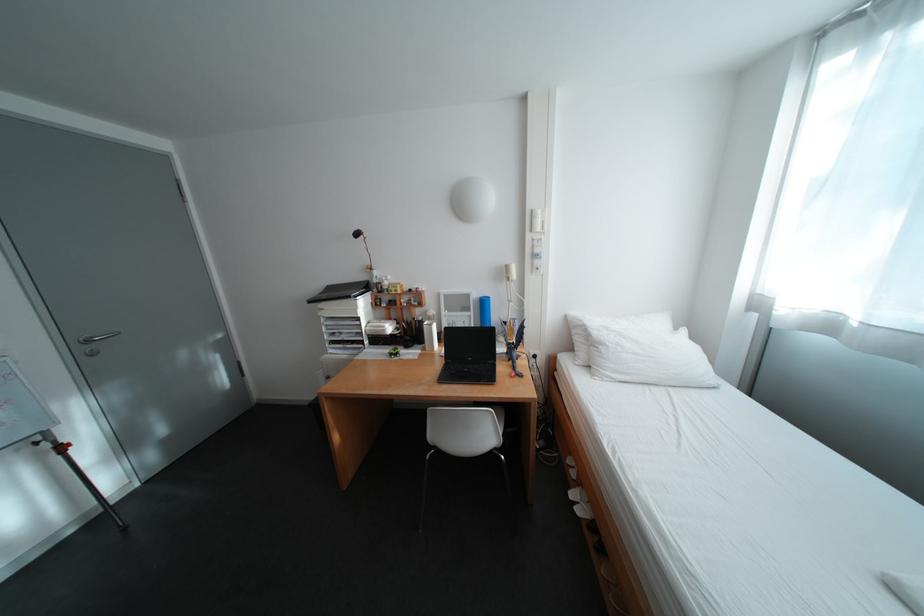
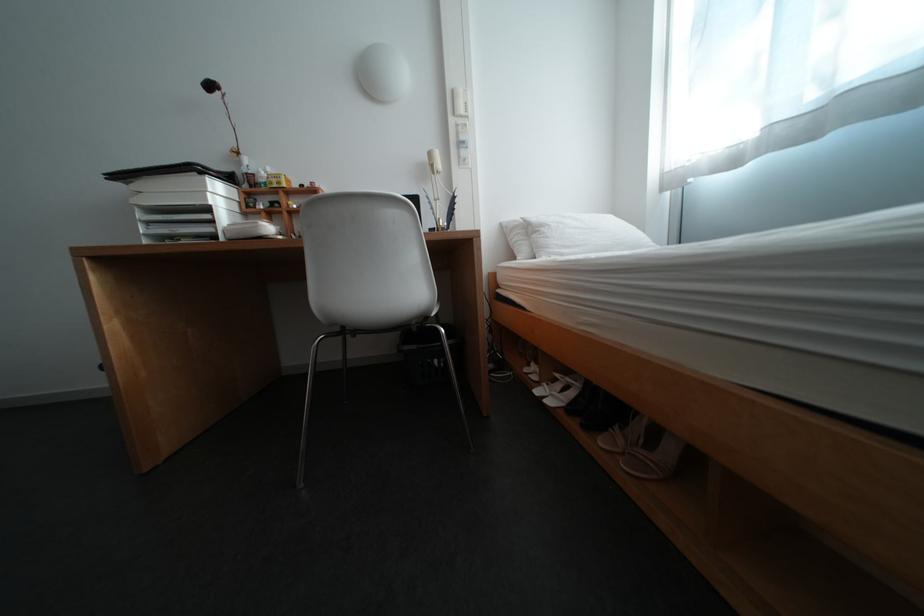
Locate, in the second image, the point that corresponds to pixel 334 322 in the first image.

(152, 217)